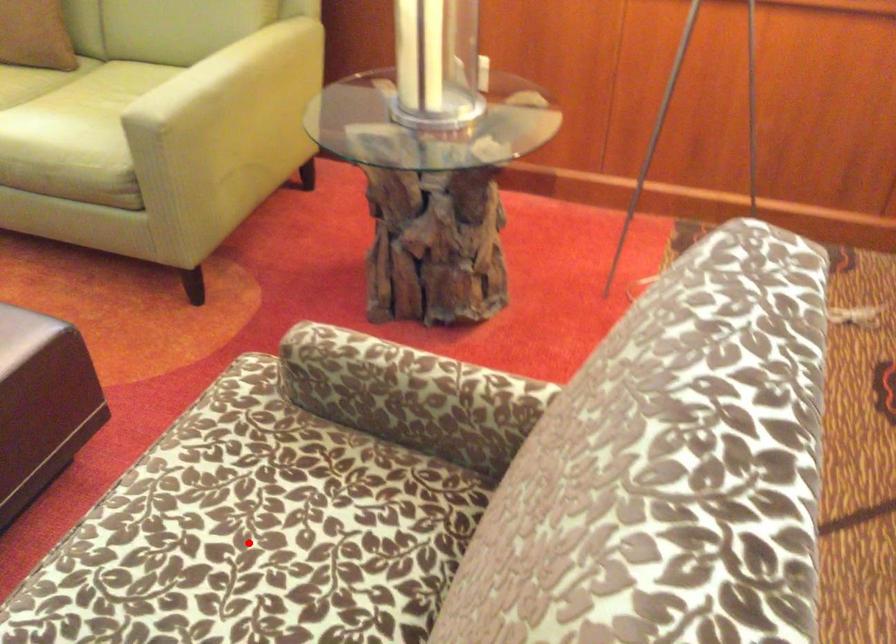
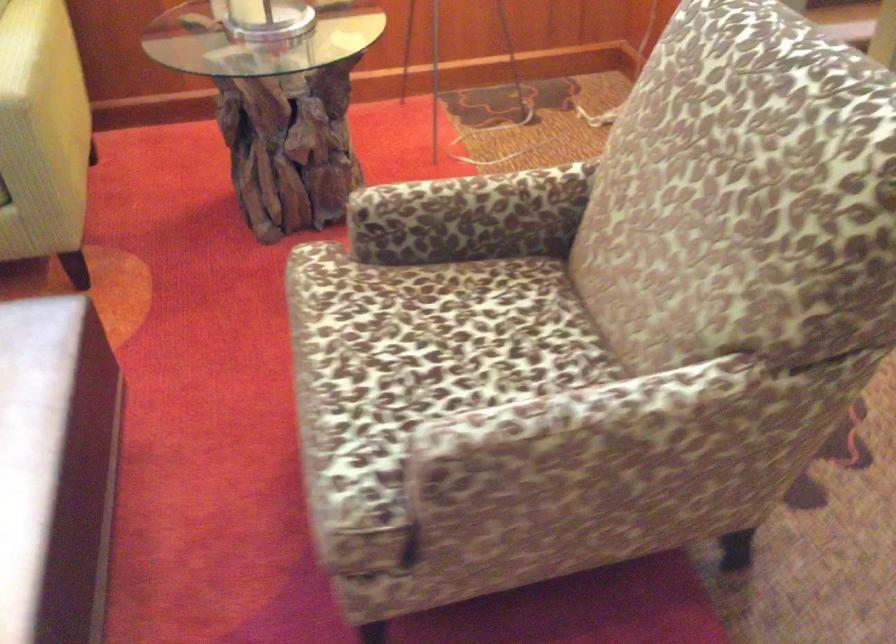
The point at the highlighted location is marked in the first image. Where is the corresponding point in the second image?

(452, 344)